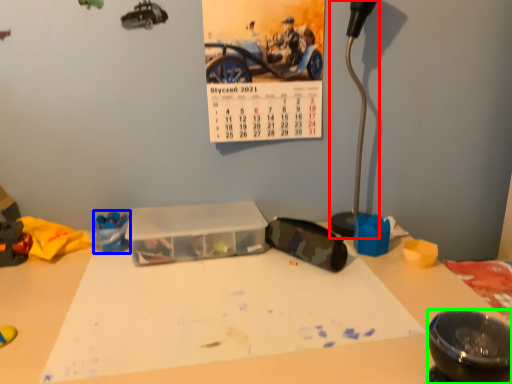
Question: Considering the real-world distances, which object is closest to lamp (highlighted by a red box)? toy (highlighted by a blue box) or bowl (highlighted by a green box).

Choices:
 (A) toy
 (B) bowl

Answer: (B)